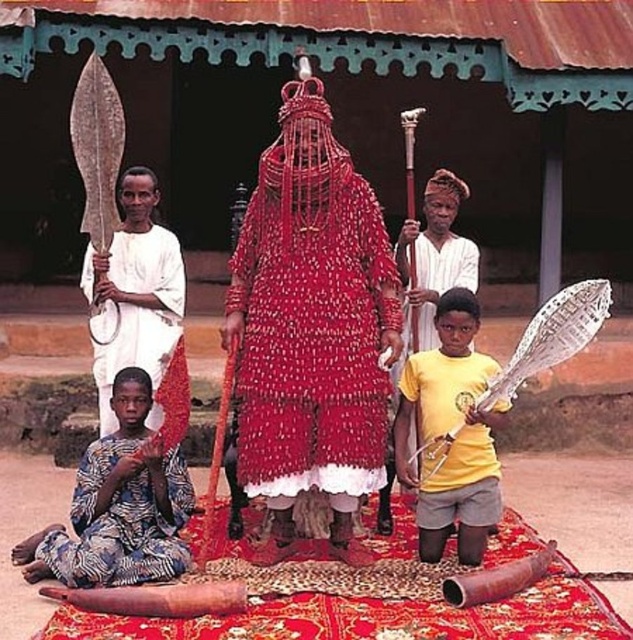
This screenshot has width=633, height=640. What are the coordinates of `yellow matte shirt at center` in the screenshot? It's located at pyautogui.click(x=448, y=428).

Does yellow matte shirt at center lie behind white clothed spear at left?

No.

Image resolution: width=633 pixels, height=640 pixels. In order to click on yellow matte shirt at center in this screenshot , I will do `click(448, 428)`.

Between red beaded robe at center and white clothed spear at left, which one has less height?

white clothed spear at left

Does red beaded robe at center have a lesser width compared to white clothed spear at left?

No.

Which is in front, point (361, 461) or point (146, 280)?

Point (361, 461) is more forward.

Image resolution: width=633 pixels, height=640 pixels. I want to click on red beaded robe at center, so click(311, 323).

Which is behind, point (132, 374) or point (115, 422)?

Positioned behind is point (115, 422).

In the scene shown: Can you confirm if printed fabric child at lower left is positioned to the right of white clothed spear at left?

Yes, printed fabric child at lower left is to the right of white clothed spear at left.

The width and height of the screenshot is (633, 640). What do you see at coordinates (118, 506) in the screenshot?
I see `printed fabric child at lower left` at bounding box center [118, 506].

Find the location of a particular element. printed fabric child at lower left is located at coordinates (118, 506).